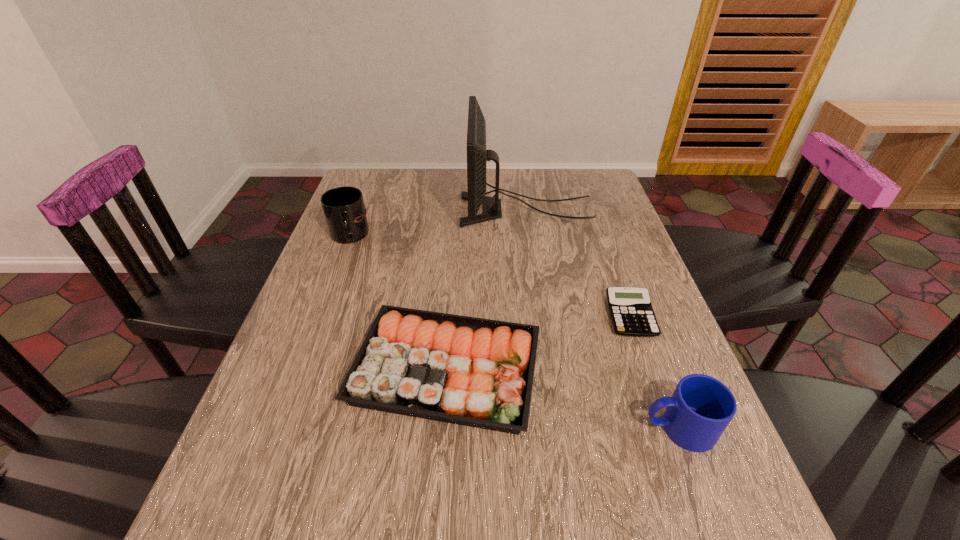
I want to click on free location located 0.170m with the handle on the side of the farther mug, so click(x=326, y=295).

Where is `free region located 0.290m on the side with the handle of the nearer mug`? Image resolution: width=960 pixels, height=540 pixels. free region located 0.290m on the side with the handle of the nearer mug is located at coordinates (485, 428).

Where is `vacant region located 0.060m on the side with the handle of the nearer mug`? The width and height of the screenshot is (960, 540). vacant region located 0.060m on the side with the handle of the nearer mug is located at coordinates (610, 428).

The width and height of the screenshot is (960, 540). I want to click on free region located 0.250m on the side with the handle of the nearer mug, so click(x=507, y=428).

This screenshot has height=540, width=960. What are the coordinates of `free space located 0.360m on the back of the second shortest object` in the screenshot? It's located at (456, 227).

You are a GUI agent. You are given a task and a screenshot of the screen. Output one action in this format:
    pyautogui.click(x=<x>, y=<y>)
    Task: Click on the vacant region located on the back of the calculator
    The image size is (960, 540).
    Given the screenshot: What is the action you would take?
    pyautogui.click(x=614, y=269)

Locate an element on the screen. The height and width of the screenshot is (540, 960). object positioned at the far edge is located at coordinates (477, 156).

Image resolution: width=960 pixels, height=540 pixels. What are the coordinates of `mug that is at the left edge` in the screenshot? It's located at (344, 210).

The width and height of the screenshot is (960, 540). In order to click on platter located at the left edge in this screenshot , I will do `click(475, 372)`.

What are the coordinates of `computer monitor present at the right edge` in the screenshot? It's located at coord(477,156).